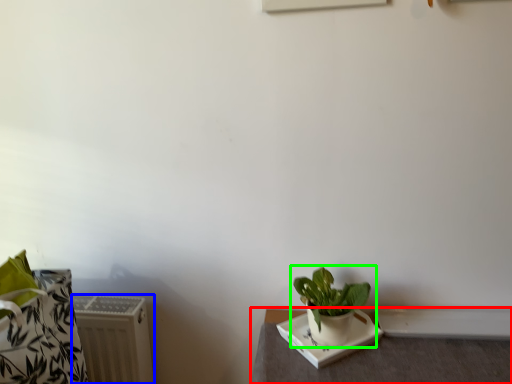
Question: Which is nearer to the table (highlighted by a red box)? radiator (highlighted by a blue box) or houseplant (highlighted by a green box).

Choices:
 (A) radiator
 (B) houseplant

Answer: (B)